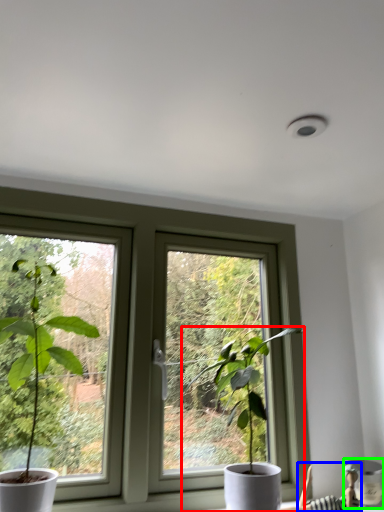
Question: Estimate the real-world distances between objects in this image. Which object is closer to houseplant (highlighted by a red box), couple (highlighted by a blue box) or vase (highlighted by a green box)?

Choices:
 (A) couple
 (B) vase

Answer: (A)